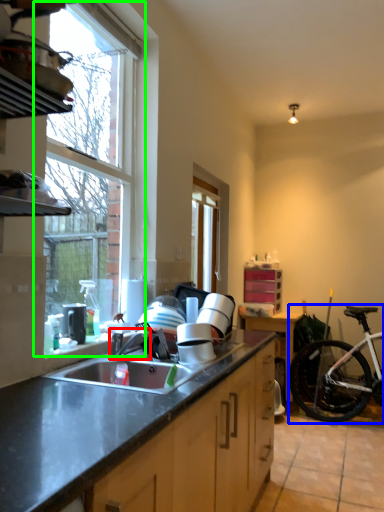
Question: Which is nearer to the faucet (highlighted by a red box)? bicycle (highlighted by a blue box) or window (highlighted by a green box).

Choices:
 (A) bicycle
 (B) window

Answer: (B)